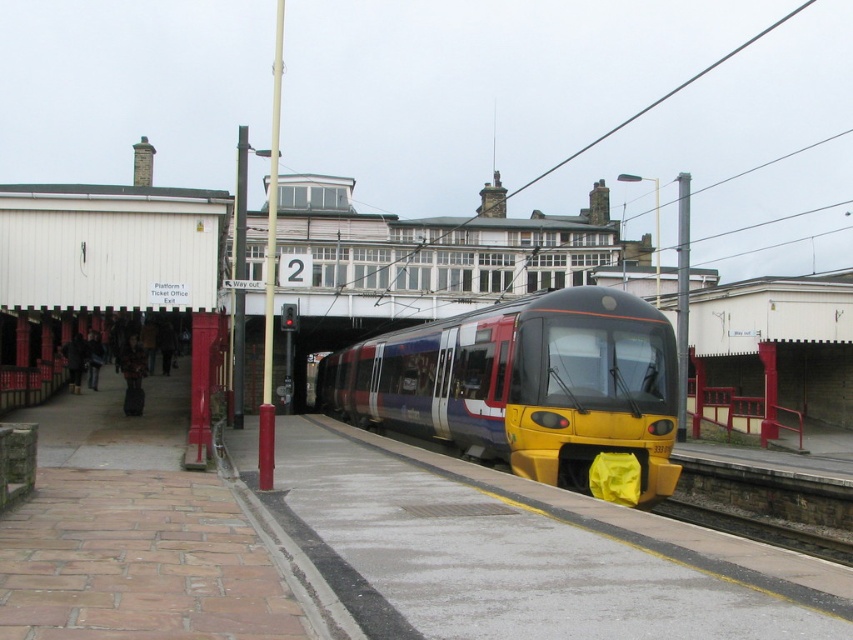
Does metallic blue train at center appear under smooth concrete train track at lower right?

Actually, metallic blue train at center is above smooth concrete train track at lower right.

Is point (408, 428) closer to camera compared to point (840, 554)?

No, (408, 428) is further to viewer.

At what (x,y) coordinates should I click in order to perform the action: click on metallic blue train at center. Please return your answer as a coordinate pair (x, y). Looking at the image, I should click on (524, 385).